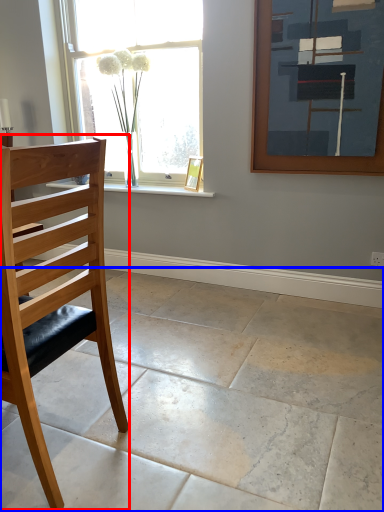
Question: Which object is further to the camera taking this photo, chair (highlighted by a red box) or concrete (highlighted by a blue box)?

Choices:
 (A) chair
 (B) concrete

Answer: (A)